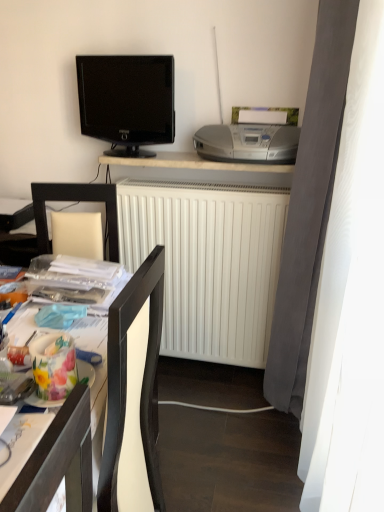
The height and width of the screenshot is (512, 384). Identify the location of wooden desk at lower left, which ranks as the second desk in back-to-front order. (38, 458).

Image resolution: width=384 pixels, height=512 pixels. What do you see at coordinates (209, 263) in the screenshot? I see `white matte radiator at center` at bounding box center [209, 263].

You are a GUI agent. You are given a task and a screenshot of the screen. Output one action in this format:
    pyautogui.click(x=<x>, y=<y>)
    Task: Click on the black glossy tv at upper left
    The width and height of the screenshot is (384, 512).
    Given the screenshot: What is the action you would take?
    pyautogui.click(x=127, y=101)

From a real-world perspective, is white matte desk at upper center, which is counted as the 2th desk, starting from the bottom, above or below silver metallic stereo at upper right?

In terms of real-world spatial position, white matte desk at upper center, which is counted as the 2th desk, starting from the bottom, is below silver metallic stereo at upper right.

Find the location of a particular element. the 1st desk to the left of the silver metallic stereo at upper right, starting your count from the anchor is located at coordinates (192, 163).

What's the angular difference between white matte desk at upper center, which ranks as the 2th desk in front-to-back order, and silver metallic stereo at upper right's facing directions?

The angular difference between white matte desk at upper center, which ranks as the 2th desk in front-to-back order, and silver metallic stereo at upper right is 1.18 degrees.

Is white matte desk at upper center, the 1th desk positioned from the back, positioned behind silver metallic stereo at upper right?

Yes, it is behind silver metallic stereo at upper right.

Which is nearer, (174,166) or (270,307)?

The point (174,166) is closer.

From the image's perspective, is white matte desk at upper center, which is counted as the 2th desk, starting from the bottom, above or below white matte radiator at center?

white matte desk at upper center, which is counted as the 2th desk, starting from the bottom, is situated higher than white matte radiator at center in the image.

Who is bigger, white matte desk at upper center, which ranks as the 2th desk in front-to-back order, or white matte radiator at center?

white matte radiator at center.

Considering the sizes of objects white matte desk at upper center, the 1th desk positioned from the back, and white matte radiator at center in the image provided, who is shorter, white matte desk at upper center, the 1th desk positioned from the back, or white matte radiator at center?

Standing shorter between the two is white matte desk at upper center, the 1th desk positioned from the back.

Locate an element on the screen. The image size is (384, 512). radiator on the right of white matte desk at upper center, the first desk when ordered from top to bottom is located at coordinates (209, 263).

From the image's perspective, would you say white matte radiator at center is positioned over white matte desk at upper center, the 1th desk positioned from the back?

Actually, white matte radiator at center appears below white matte desk at upper center, the 1th desk positioned from the back, in the image.

Is white matte radiator at center situated inside white matte desk at upper center, the first desk when ordered from top to bottom, or outside?

white matte radiator at center cannot be found inside white matte desk at upper center, the first desk when ordered from top to bottom.

I want to click on television that is above the white matte radiator at center (from the image's perspective), so click(x=127, y=101).

Are white matte radiator at center and black glossy tv at upper left far apart?

No, there isn't a large distance between white matte radiator at center and black glossy tv at upper left.

Can you confirm if white matte radiator at center is wider than black glossy tv at upper left?

Yes, white matte radiator at center is wider than black glossy tv at upper left.

Is white matte radiator at center spatially inside black glossy tv at upper left, or outside of it?

white matte radiator at center is located beyond the bounds of black glossy tv at upper left.

From a real-world perspective, is black glossy tv at upper left positioned over white matte radiator at center based on gravity?

Yes, from a real-world perspective, black glossy tv at upper left is on top of white matte radiator at center.

Is black glossy tv at upper left closer to the viewer compared to white matte radiator at center?

Yes, black glossy tv at upper left is closer to the camera.

Is point (127, 110) closer or farther from the camera than point (200, 291)?

Point (127, 110) appears to be closer to the viewer than point (200, 291).

Locate an element on the screen. This screenshot has height=512, width=384. radiator located underneath the black glossy tv at upper left (from a real-world perspective) is located at coordinates (209, 263).

Looking at this image, between wooden desk at lower left, which ranks as the second desk in back-to-front order, and white matte radiator at center, which one has less height?

Standing shorter between the two is white matte radiator at center.

Which object is positioned more to the left, wooden desk at lower left, arranged as the 2th desk when viewed from the top, or white matte radiator at center?

wooden desk at lower left, arranged as the 2th desk when viewed from the top.

Is wooden desk at lower left, the 1th desk viewed from the front, touching white matte radiator at center?

wooden desk at lower left, the 1th desk viewed from the front, is not next to white matte radiator at center, and they're not touching.

Is wooden desk at lower left, which ranks as the second desk in back-to-front order, surrounding white matte radiator at center?

Definitely not — white matte radiator at center is not inside wooden desk at lower left, which ranks as the second desk in back-to-front order.

Does silver metallic stereo at upper right lie behind white matte radiator at center?

No, silver metallic stereo at upper right is closer to the camera.

What's the angular difference between silver metallic stereo at upper right and white matte radiator at center's facing directions?

1.18 degrees.

Is point (264, 160) positioned before point (250, 274)?

Yes, point (264, 160) is in front of point (250, 274).

Which object is wider, silver metallic stereo at upper right or white matte radiator at center?

silver metallic stereo at upper right.

Where is `printer located on the right of white matte desk at upper center, which ranks as the 2th desk in front-to-back order`? printer located on the right of white matte desk at upper center, which ranks as the 2th desk in front-to-back order is located at coordinates (252, 137).

The image size is (384, 512). Find the location of `the 1st desk to the left of the white matte radiator at center, starting your count from the anchor`. the 1st desk to the left of the white matte radiator at center, starting your count from the anchor is located at coordinates (192, 163).

When comparing their distances from white matte desk at upper center, the 1th desk positioned from the back, does wooden desk at lower left, arranged as the 2th desk when viewed from the top, or black glossy tv at upper left seem further?

The object further to white matte desk at upper center, the 1th desk positioned from the back, is wooden desk at lower left, arranged as the 2th desk when viewed from the top.

Which object lies nearer to the anchor point silver metallic stereo at upper right, white matte desk at upper center, which is counted as the 2th desk, starting from the bottom, or wooden desk at lower left, which ranks as the second desk in back-to-front order?

white matte desk at upper center, which is counted as the 2th desk, starting from the bottom.

From the picture: When comparing their distances from wooden desk at lower left, which is the 1th desk in bottom-to-top order, does white matte radiator at center or silver metallic stereo at upper right seem closer?

white matte radiator at center is positioned closer to the anchor wooden desk at lower left, which is the 1th desk in bottom-to-top order.

Estimate the real-world distances between objects in this image. Which object is closer to white matte radiator at center, white matte desk at upper center, the first desk when ordered from top to bottom, or black glossy tv at upper left?

Among the two, white matte desk at upper center, the first desk when ordered from top to bottom, is located nearer to white matte radiator at center.

Which object lies nearer to the anchor point white matte radiator at center, black glossy tv at upper left or silver metallic stereo at upper right?

silver metallic stereo at upper right lies closer to white matte radiator at center than the other object.

Which object lies nearer to the anchor point black glossy tv at upper left, silver metallic stereo at upper right or white matte desk at upper center, the first desk when ordered from top to bottom?

white matte desk at upper center, the first desk when ordered from top to bottom.

Which object lies further to the anchor point white matte desk at upper center, the 1th desk positioned from the back, black glossy tv at upper left or silver metallic stereo at upper right?

black glossy tv at upper left.

From the image, which object appears to be nearer to black glossy tv at upper left, white matte desk at upper center, which is counted as the 2th desk, starting from the bottom, or wooden desk at lower left, which ranks as the second desk in back-to-front order?

Based on the image, white matte desk at upper center, which is counted as the 2th desk, starting from the bottom, appears to be nearer to black glossy tv at upper left.

Locate an element on the screen. The height and width of the screenshot is (512, 384). printer between wooden desk at lower left, the 1th desk viewed from the front, and white matte radiator at center in the front-back direction is located at coordinates (252, 137).

Where is `desk between black glossy tv at upper left and white matte radiator at center in the up-down direction`? This screenshot has width=384, height=512. desk between black glossy tv at upper left and white matte radiator at center in the up-down direction is located at coordinates (192, 163).

Identify the location of desk that lies between silver metallic stereo at upper right and white matte radiator at center from top to bottom. click(192, 163).

Locate an element on the screen. This screenshot has width=384, height=512. printer between wooden desk at lower left, the 1th desk viewed from the front, and white matte desk at upper center, the first desk when ordered from top to bottom, from front to back is located at coordinates [252, 137].